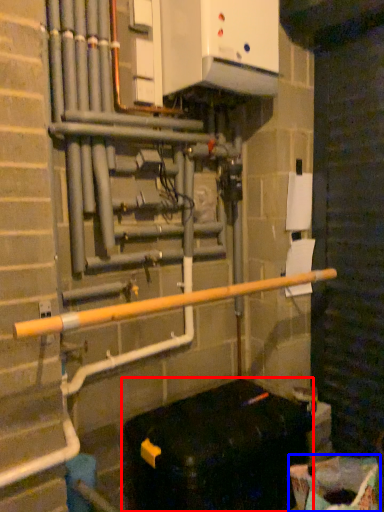
Question: Which of the following is the farthest to the observer, furniture (highlighted by a red box) or recycling bin (highlighted by a blue box)?

Choices:
 (A) furniture
 (B) recycling bin

Answer: (A)